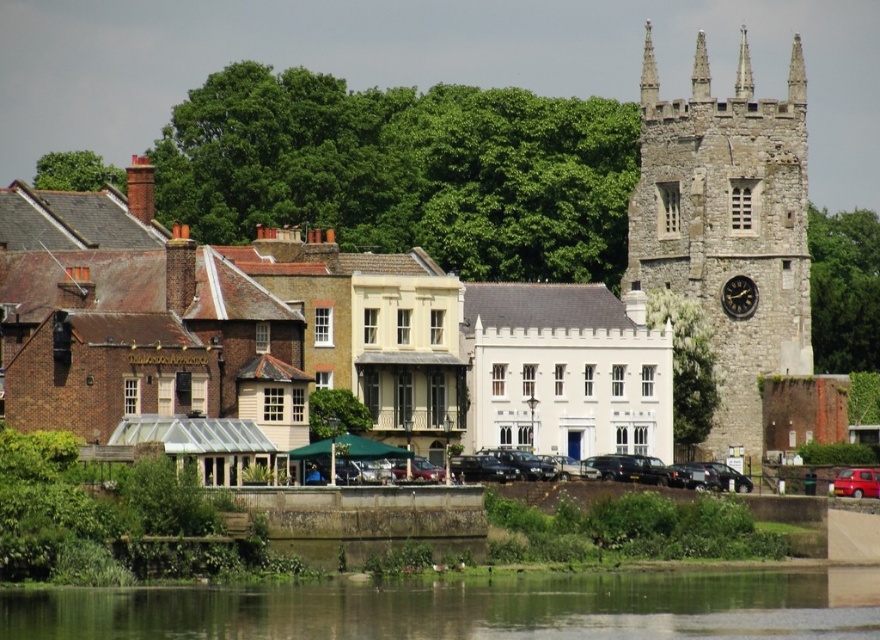
Question: Considering the real-world distances, which object is farthest from the stone clock tower at right?

Choices:
 (A) black metal clock at upper right
 (B) green smooth water at lower center

Answer: (B)

Question: From the image, what is the correct spatial relationship of green smooth water at lower center in relation to shiny red car at lower right?

Choices:
 (A) left
 (B) right

Answer: (A)

Question: Can you confirm if green smooth water at lower center is positioned to the right of black metal clock at upper right?

Choices:
 (A) no
 (B) yes

Answer: (A)

Question: Among these points, which one is farthest from the camera?

Choices:
 (A) (859, 474)
 (B) (801, 634)

Answer: (A)

Question: Among these points, which one is farthest from the camera?

Choices:
 (A) (742, 288)
 (B) (853, 474)
 (C) (180, 621)
 (D) (767, 371)

Answer: (A)

Question: Does green smooth water at lower center appear on the right side of shiny red car at lower right?

Choices:
 (A) yes
 (B) no

Answer: (B)